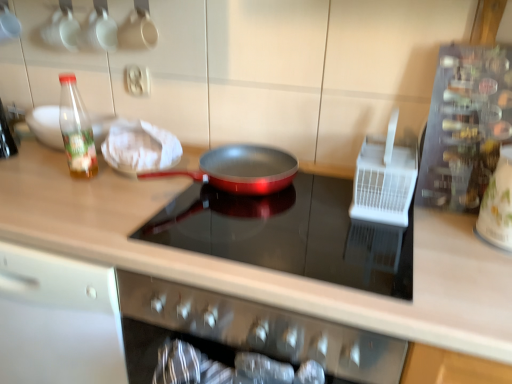
Where is `free spot in front of transparent plastic bottle at left`? free spot in front of transparent plastic bottle at left is located at coordinates (68, 200).